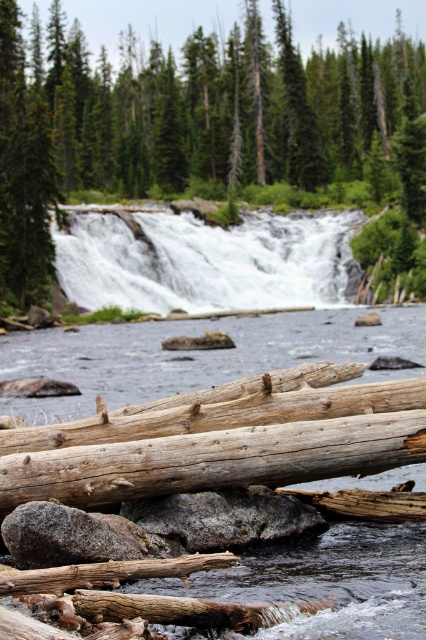
Question: Considering the relative positions of green textured tree at upper center and gray rough rock at lower left in the image provided, where is green textured tree at upper center located with respect to gray rough rock at lower left?

Choices:
 (A) below
 (B) above

Answer: (B)

Question: Which of the following is the closest to the observer?

Choices:
 (A) green textured tree at upper center
 (B) gray rough rock at lower left
 (C) white frothy water at center

Answer: (B)

Question: Which point is farther from the camera taking this photo?

Choices:
 (A) (109, 554)
 (B) (256, 230)

Answer: (B)

Question: Considering the real-world distances, which object is closest to the weathered wood log at lower center?

Choices:
 (A) green textured tree at upper center
 (B) gray rough rock at lower left
 (C) green matte tree at upper left
 (D) rough gray rock at center

Answer: (D)

Question: Does white frothy water at center have a lesser width compared to green matte tree at upper left?

Choices:
 (A) yes
 (B) no

Answer: (B)

Question: Considering the relative positions of rough gray rock at center and gray rough rock at lower left in the image provided, where is rough gray rock at center located with respect to gray rough rock at lower left?

Choices:
 (A) right
 (B) left

Answer: (A)